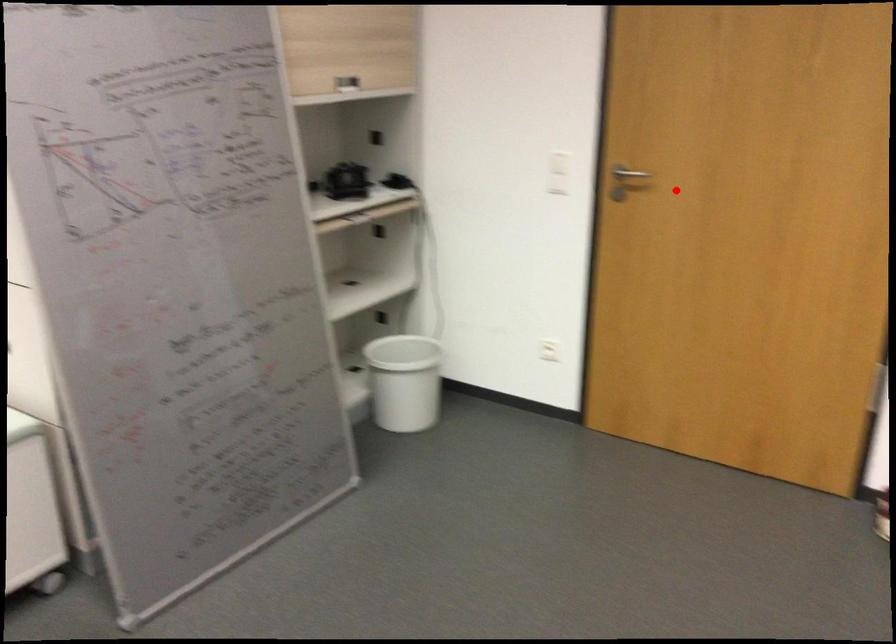
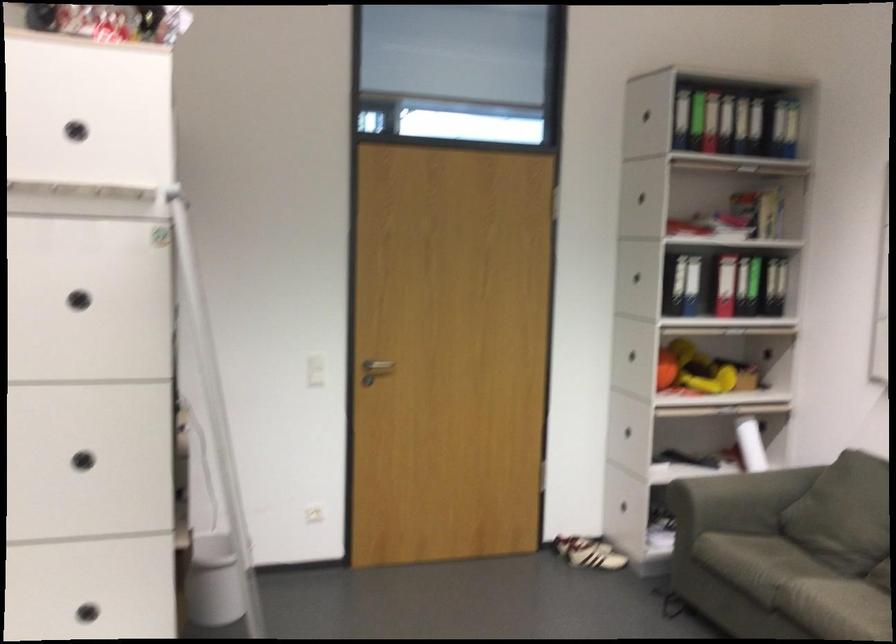
Question: I am providing you with two images of the same scene from different viewpoints. Image1 has a red point marked. In image2, the corresponding 3D location appears at what relative position? Reply with the corresponding letter.

Choices:
 (A) Closer
 (B) Farther

Answer: (B)